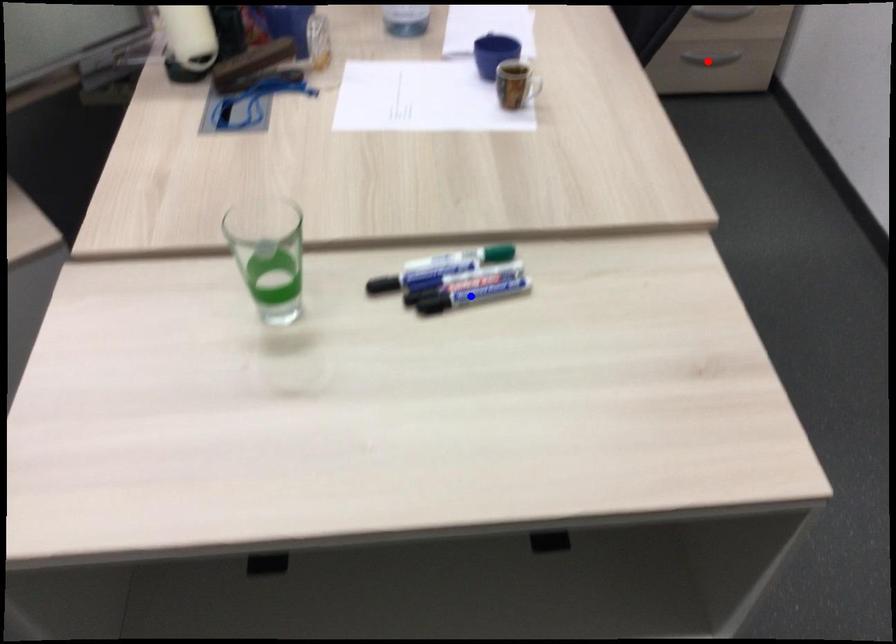
Question: Which of the two points in the image is closer to the camera?

Choices:
 (A) Blue point is closer.
 (B) Red point is closer.

Answer: (A)